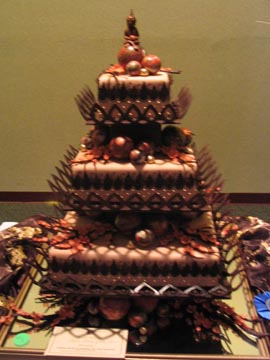
This screenshot has height=360, width=270. What are the coordinates of `carpeting` in the screenshot? It's located at (11, 209).